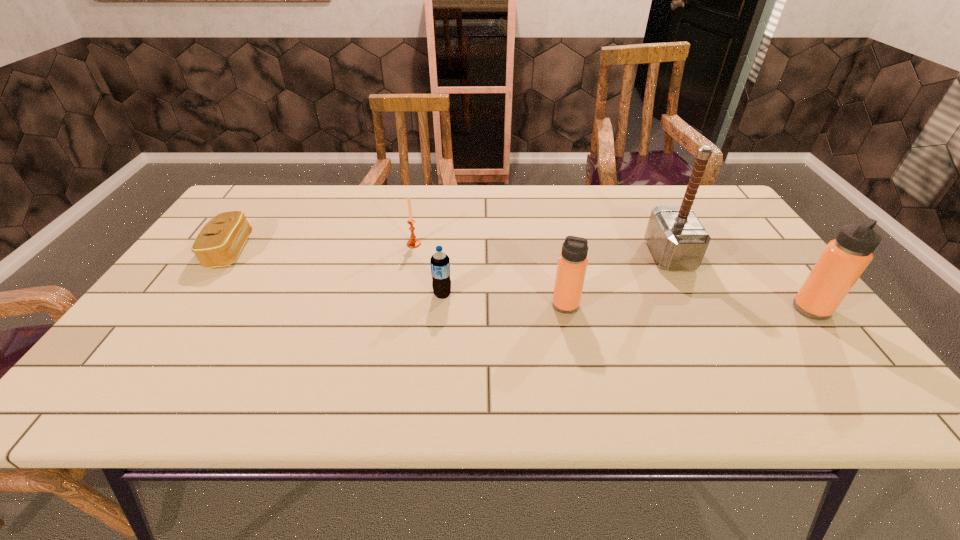
I want to click on empty space between the candle_holder and the right thermos bottle, so click(612, 276).

This screenshot has height=540, width=960. I want to click on vacant area that lies between the shortest object and the left thermos bottle, so click(x=398, y=278).

The width and height of the screenshot is (960, 540). In order to click on empty location between the right thermos bottle and the clutch bag in this screenshot , I will do `click(521, 280)`.

Locate which object is the fifth closest to the candle_holder. Please provide its 2D coordinates. Your answer should be formatted as a tuple, i.e. [(x, y)], where the tuple contains the x and y coordinates of a point satisfying the conditions above.

[(845, 258)]

The height and width of the screenshot is (540, 960). What are the coordinates of `the fourth closest object to the fourth object from right to left` in the screenshot? It's located at (678, 241).

Identify the location of free space that satisfies the following two spatial constraints: 1. on the front side of the second object from right to left; 2. on the left side of the fifth object from right to left. 412,255.

Where is `free space that satisfies the following two spatial constraints: 1. on the front side of the left thermos bottle; 2. on the left side of the rightmost object`? The image size is (960, 540). free space that satisfies the following two spatial constraints: 1. on the front side of the left thermos bottle; 2. on the left side of the rightmost object is located at coordinates (566, 309).

Find the location of `vacant space that satisfies the following two spatial constraints: 1. on the front side of the tallest object; 2. on the left side of the fifth object from right to left`. vacant space that satisfies the following two spatial constraints: 1. on the front side of the tallest object; 2. on the left side of the fifth object from right to left is located at coordinates (412, 255).

Locate an element on the screen. The height and width of the screenshot is (540, 960). free space that satisfies the following two spatial constraints: 1. on the zipper side of the third object from left to right; 2. on the right side of the leftmost object is located at coordinates (201, 294).

Locate an element on the screen. This screenshot has height=540, width=960. free spot that satisfies the following two spatial constraints: 1. on the zipper side of the fourth shortest object; 2. on the left side of the shortest object is located at coordinates (193, 305).